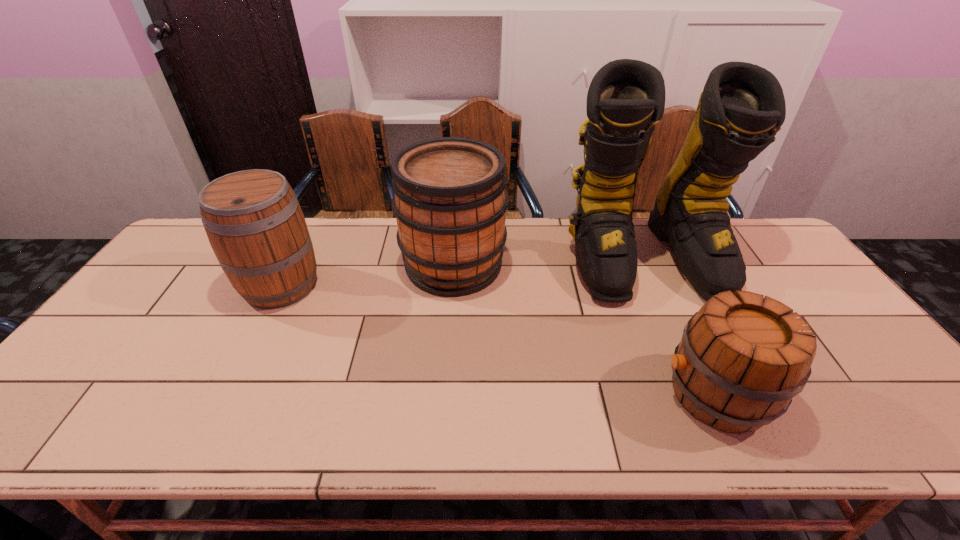
At what (x,y) coordinates should I click in order to perform the action: click on blank region between the ski boots and the second object from left to right. Please return your answer as a coordinate pair (x, y). The height and width of the screenshot is (540, 960). Looking at the image, I should click on (549, 261).

This screenshot has width=960, height=540. Find the location of `unoccupied position between the tallest object and the second cider from left to right`. unoccupied position between the tallest object and the second cider from left to right is located at coordinates (549, 261).

This screenshot has width=960, height=540. What are the coordinates of `empty location between the second cider from left to right and the leftmost object` in the screenshot? It's located at (367, 275).

At what (x,y) coordinates should I click in order to perform the action: click on free spot between the leftmost object and the second cider from right to left. Please return your answer as a coordinate pair (x, y). Image resolution: width=960 pixels, height=540 pixels. Looking at the image, I should click on (367, 275).

Locate which object ranks in proximity to the tallest object. Please provide its 2D coordinates. Your answer should be formatted as a tuple, i.e. [(x, y)], where the tuple contains the x and y coordinates of a point satisfying the conditions above.

[(741, 360)]

Locate an element on the screen. The image size is (960, 540). object that is the closest to the leftmost cider is located at coordinates (450, 202).

Identify the location of cider object that ranks as the second closest to the leftmost cider. This screenshot has height=540, width=960. (741, 360).

Point out which cider is positioned as the nearest to the nearest cider. Please provide its 2D coordinates. Your answer should be formatted as a tuple, i.e. [(x, y)], where the tuple contains the x and y coordinates of a point satisfying the conditions above.

[(450, 202)]

I want to click on free location that satisfies the following two spatial constraints: 1. on the back side of the tallest object; 2. on the left side of the leftmost cider, so click(x=295, y=258).

Where is `free space that satisfies the following two spatial constraints: 1. on the back side of the second cider from left to right; 2. on the left side of the leftmost cider`? This screenshot has height=540, width=960. free space that satisfies the following two spatial constraints: 1. on the back side of the second cider from left to right; 2. on the left side of the leftmost cider is located at coordinates (291, 265).